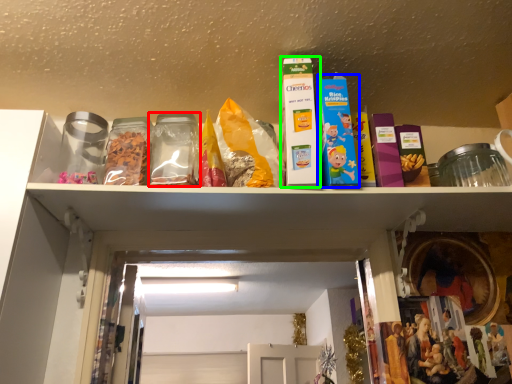
Question: Which object is positioned closest to glass jar (highlighted by a red box)? Select from product (highlighted by a blue box) and product (highlighted by a green box).

Choices:
 (A) product
 (B) product

Answer: (B)